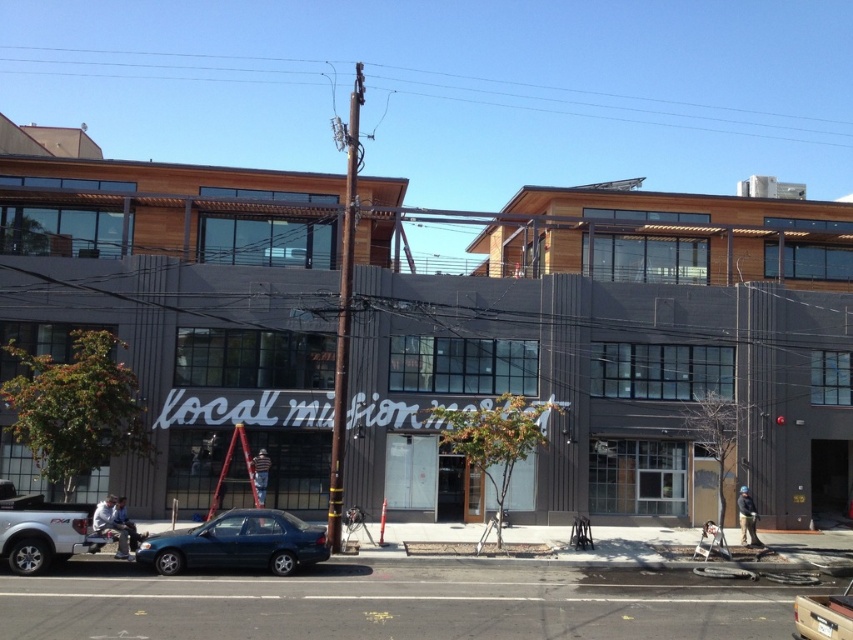
You are a delivery driver who needs to park your white matte truck at lower left near the teal matte sedan at center. Based on the scene, can you safely maneuver your truck to park next to the sedan without blocking the sidewalk where people are working?

The teal matte sedan at center is below the white matte truck at lower left, meaning the truck is positioned higher up. Since the truck is already at a lower left position relative to the sedan, it might already be near it. However, the description doesn not provide exact distance or space between them. To park safely without blocking the sidewalk, ensure there is enough space between the truck and the sidewalk where workers are. If the truck is at lower left and the sedan is centered, moving the truck to a

You are standing at the base of the building looking up. There are two points marked on the facade at coordinates point (837, 419) and point (10, 486). Which point is closer to your eyes?

Point (10, 486) is closer to your eyes because it is nearer to the camera compared to point (837, 419), which is further away.

Looking at this image, you are a delivery driver approaching the construction site. You need to park your metallic silver truck at center without blocking the matte black sign at center. Is there enough space between them?

The matte black sign at center might be wider than metallic silver truck at center, so there may not be enough space to park the metallic silver truck at center without blocking the matte black sign at center. Check the dimensions before parking.